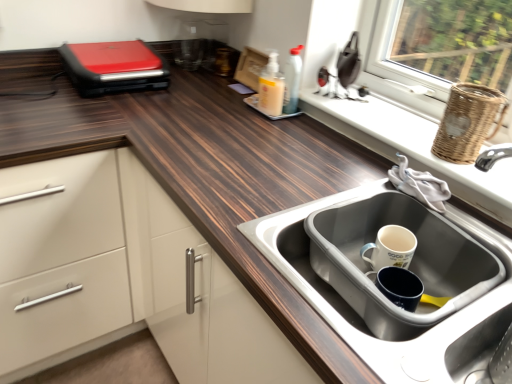
Question: From the image's perspective, is woven brown basket at upper right above or below red matte sandwich maker at upper left?

Choices:
 (A) above
 (B) below

Answer: (B)

Question: Based on their positions, is woven brown basket at upper right located to the left or right of red matte sandwich maker at upper left?

Choices:
 (A) right
 (B) left

Answer: (A)

Question: Which of these objects is positioned farthest from the wooden countertop at upper left?

Choices:
 (A) white wicker basket at right
 (B) woven brown basket at upper right
 (C) red matte sandwich maker at upper left
 (D) white matte mug at sink
 (E) translucent plastic soap dispenser at center

Answer: (B)

Question: Based on their relative distances, which object is farther from the white wicker basket at right?

Choices:
 (A) red matte sandwich maker at upper left
 (B) white matte mug at sink
 (C) translucent plastic soap dispenser at center
 (D) stainless steel sink at lower right
 (E) woven brown basket at upper right

Answer: (A)